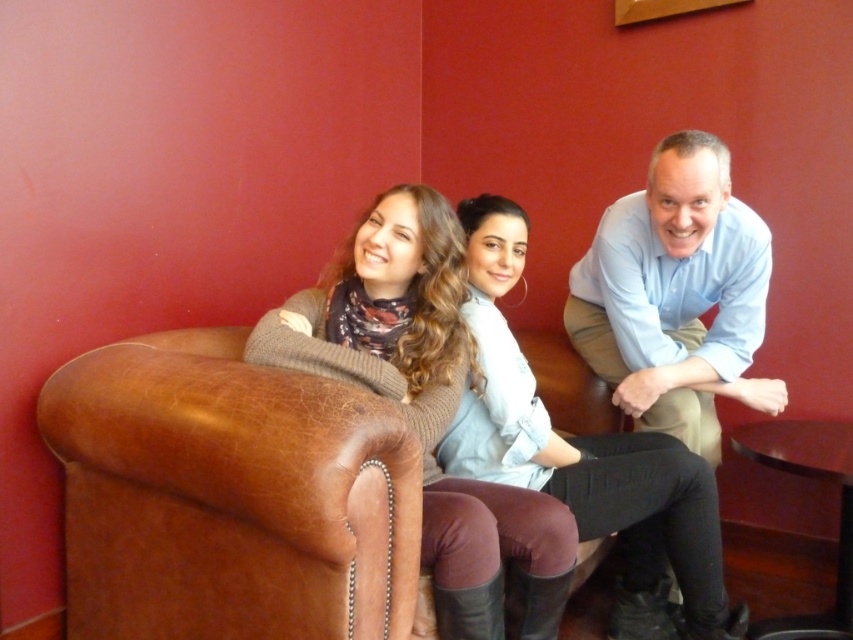
Based on the photo, is light blue shirt at center taller than light blue denim shirt at center?

In fact, light blue shirt at center may be shorter than light blue denim shirt at center.

Is point (668, 381) closer to camera compared to point (495, 355)?

No.

Identify the location of light blue shirt at center. The image size is (853, 640). (676, 296).

How distant is matte brown sweater at center from light blue shirt at center?

matte brown sweater at center and light blue shirt at center are 27.96 inches apart.

Does point (462, 524) come in front of point (671, 416)?

Yes, it is.

Is point (410, 236) more distant than point (756, 230)?

No, (410, 236) is closer to viewer.

Identify the location of matte brown sweater at center. The height and width of the screenshot is (640, 853). (427, 404).

Can you confirm if matte brown sweater at center is positioned to the right of light blue denim shirt at center?

No, matte brown sweater at center is not to the right of light blue denim shirt at center.

Does matte brown sweater at center come in front of light blue denim shirt at center?

Yes, matte brown sweater at center is in front of light blue denim shirt at center.

Describe the element at coordinates (427, 404) in the screenshot. I see `matte brown sweater at center` at that location.

At what (x,y) coordinates should I click in order to perform the action: click on matte brown sweater at center. Please return your answer as a coordinate pair (x, y). The width and height of the screenshot is (853, 640). Looking at the image, I should click on (427, 404).